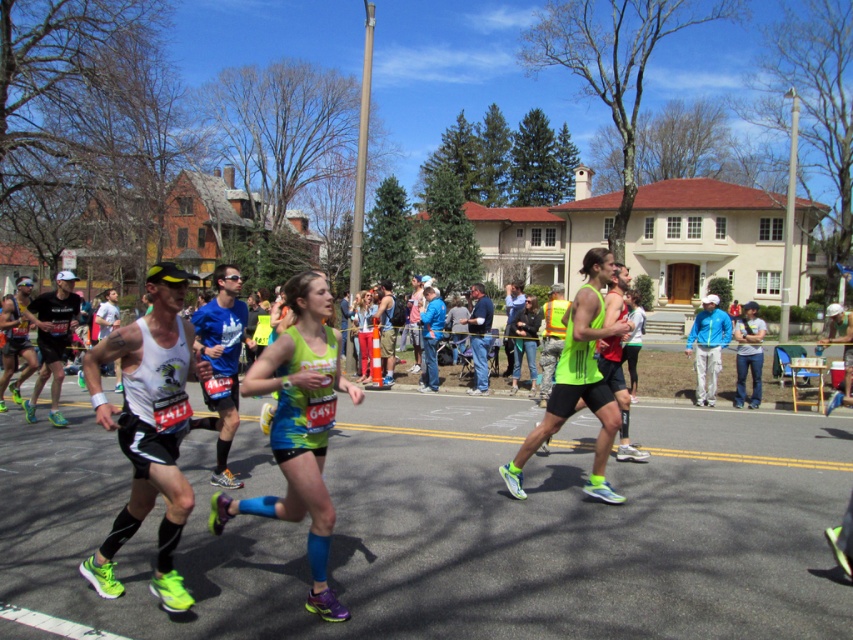
Question: Which point appears farthest from the camera in this image?

Choices:
 (A) (369, 307)
 (B) (334, 420)

Answer: (A)

Question: Which point is closer to the camera?

Choices:
 (A) neon green fabric at center
 (B) neon green tank top at center

Answer: (A)

Question: In this image, where is neon green fabric at center located relative to neon green tank top at center?

Choices:
 (A) above
 (B) below

Answer: (B)

Question: Can you confirm if neon green fabric at center is wider than neon green tank top at center?

Choices:
 (A) no
 (B) yes

Answer: (B)

Question: Considering the relative positions of neon green fabric at center and neon green tank top at center in the image provided, where is neon green fabric at center located with respect to neon green tank top at center?

Choices:
 (A) above
 (B) below

Answer: (B)